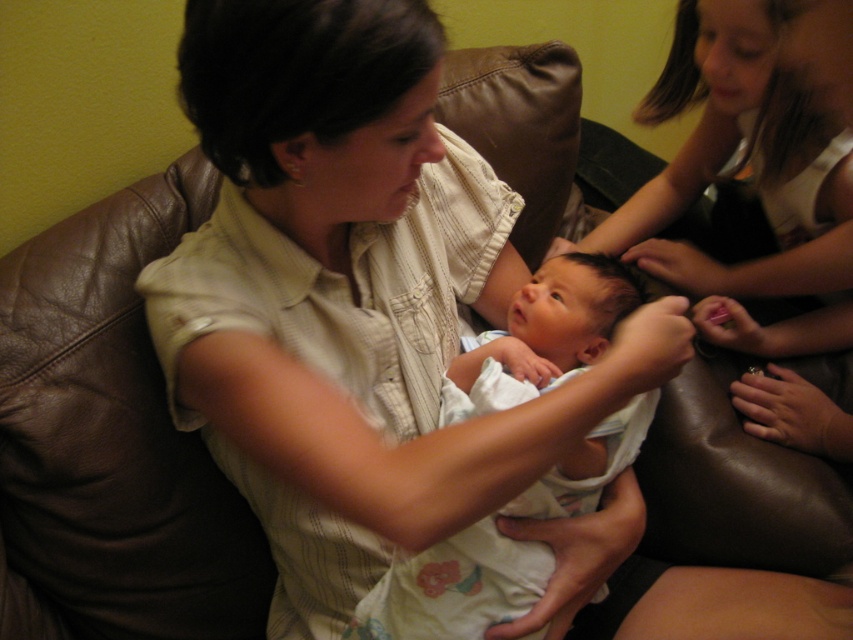
Between white striped shirt at center and white cotton baby at center, which one is positioned lower?

white cotton baby at center

The image size is (853, 640). Identify the location of white striped shirt at center. (352, 298).